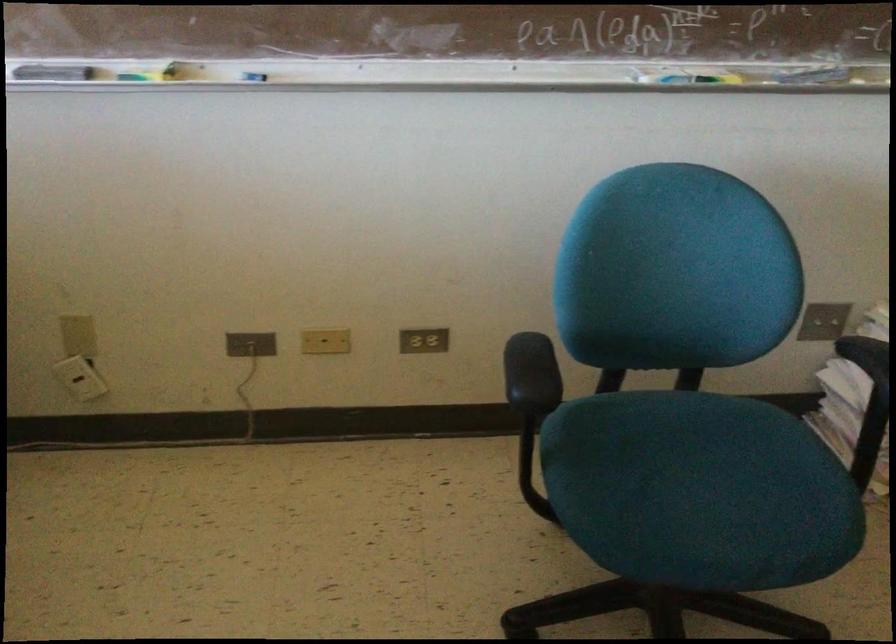
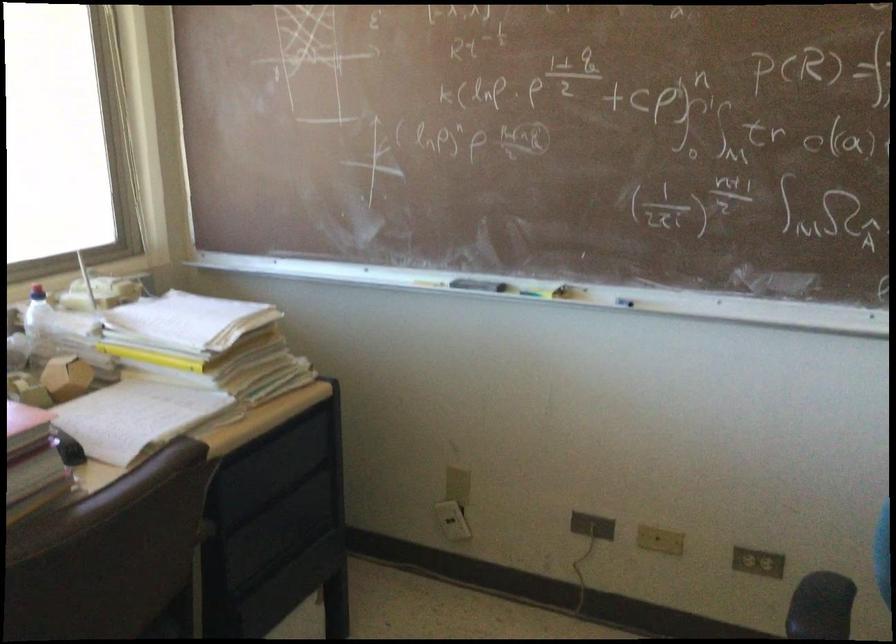
Where in the second image is the point corresponding to the point at 136,70 from the first image?

(538, 289)